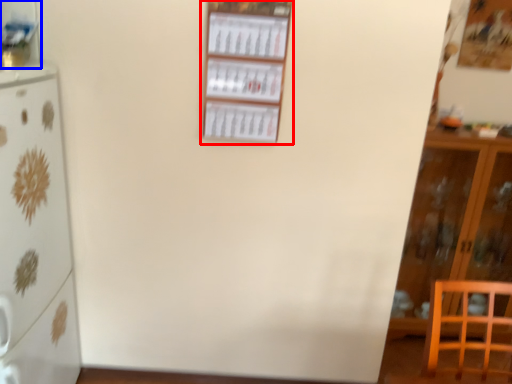
Question: Which of the following is the closest to the observer, shelf (highlighted by a red box) or shelf (highlighted by a blue box)?

Choices:
 (A) shelf
 (B) shelf

Answer: (B)